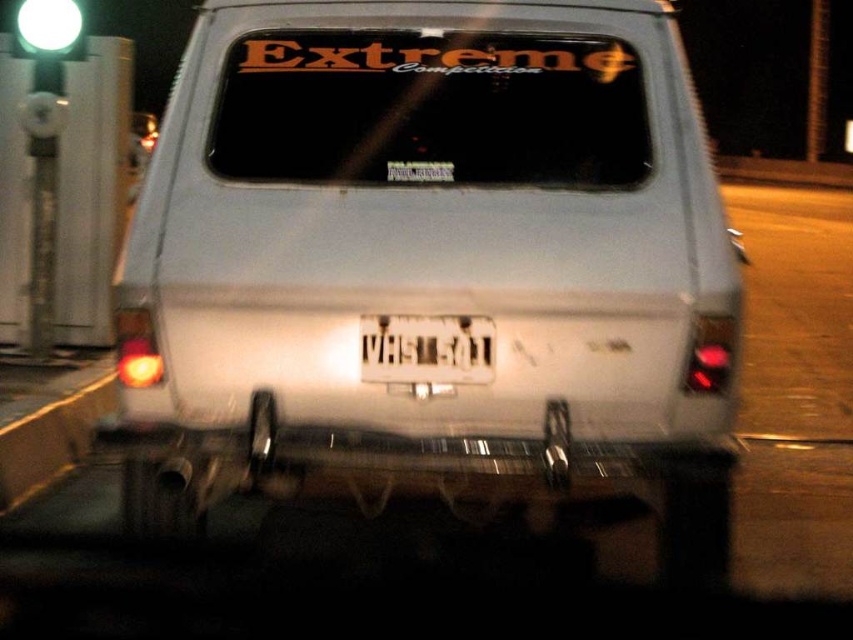
Who is shorter, white matte van at center or white plastic license plate at center?

white plastic license plate at center

Which is behind, point (271, 310) or point (415, 323)?

Positioned behind is point (271, 310).

The image size is (853, 640). Find the location of `white matte van at center`. white matte van at center is located at coordinates (432, 257).